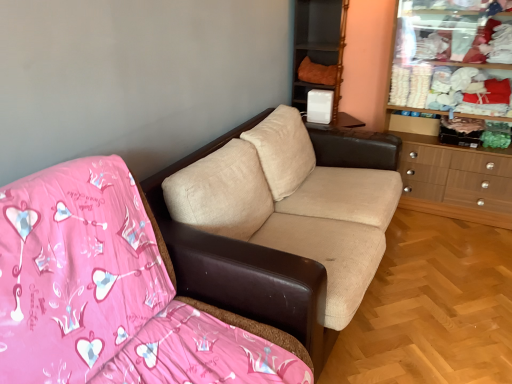
Question: From a real-world perspective, is beige fabric couch at center, arranged as the 2th studio couch when viewed from the back, positioned above or below beige fabric couch at center, which is counted as the 1th studio couch, starting from the back?

Choices:
 (A) below
 (B) above

Answer: (B)

Question: Based on their sizes in the image, would you say beige fabric couch at center, arranged as the 2th studio couch when viewed from the back, is bigger or smaller than beige fabric couch at center, which is counted as the 1th studio couch, starting from the back?

Choices:
 (A) small
 (B) big

Answer: (B)

Question: Considering the real-world distances, which object is farthest from the orange fabric cushion at upper center?

Choices:
 (A) beige fabric couch at center, which is the second studio couch from front to back
 (B) wooden dresser at right
 (C) beige fabric couch at center, arranged as the 2th studio couch when viewed from the back

Answer: (C)

Question: Based on their relative distances, which object is farther from the wooden dresser at right?

Choices:
 (A) beige fabric couch at center, which is counted as the 1th studio couch, starting from the back
 (B) beige fabric couch at center, the first studio couch when ordered from front to back
 (C) orange fabric cushion at upper center

Answer: (B)